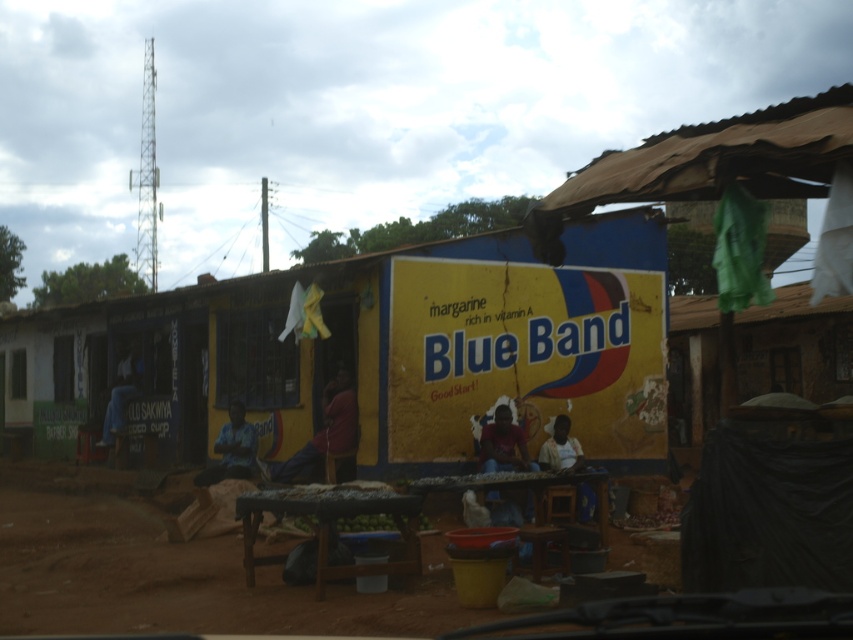
Question: Among these points, which one is farthest from the camera?

Choices:
 (A) (195, 618)
 (B) (509, 451)

Answer: (B)

Question: Which point appears farthest from the camera in this image?

Choices:
 (A) (340, 524)
 (B) (125, 417)
 (C) (242, 429)
 (D) (322, 440)

Answer: (B)

Question: In this image, where is blue fabric shirt at left located relative to green matte fruit at center?

Choices:
 (A) right
 (B) left

Answer: (B)

Question: Is matte red shirt at center positioned at the back of green matte fruit at center?

Choices:
 (A) yes
 (B) no

Answer: (A)

Question: Which of the following is the farthest from the observer?

Choices:
 (A) [x=296, y=516]
 (B) [x=125, y=422]
 (C) [x=276, y=468]

Answer: (B)

Question: Is matte red shirt at center bigger than green matte fruit at center?

Choices:
 (A) yes
 (B) no

Answer: (A)